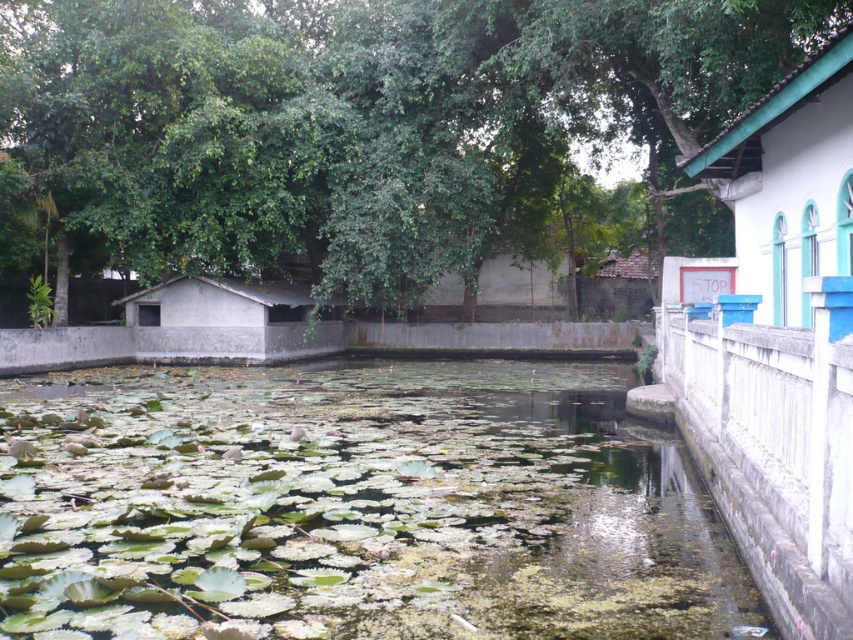
Can you confirm if green algae-covered water at center is positioned above white painted wood hut at upper right?

No, green algae-covered water at center is not above white painted wood hut at upper right.

Is green algae-covered water at center below white painted wood hut at upper right?

Yes.

Which is in front, point (260, 568) or point (810, 228)?

Point (260, 568) is more forward.

This screenshot has width=853, height=640. Find the location of `green algae-covered water at center`. green algae-covered water at center is located at coordinates (355, 506).

Who is taller, green leafy tree at upper center or white painted wood hut at upper right?

green leafy tree at upper center

Find the location of a particular element. This screenshot has width=853, height=640. green leafy tree at upper center is located at coordinates (363, 129).

Based on the photo, between green algae-covered water at center and brown clay hut at center, which one is positioned lower?

green algae-covered water at center is lower down.

Can you confirm if green algae-covered water at center is positioned to the right of brown clay hut at center?

No, green algae-covered water at center is not to the right of brown clay hut at center.

Where is `green algae-covered water at center`? This screenshot has width=853, height=640. green algae-covered water at center is located at coordinates (355, 506).